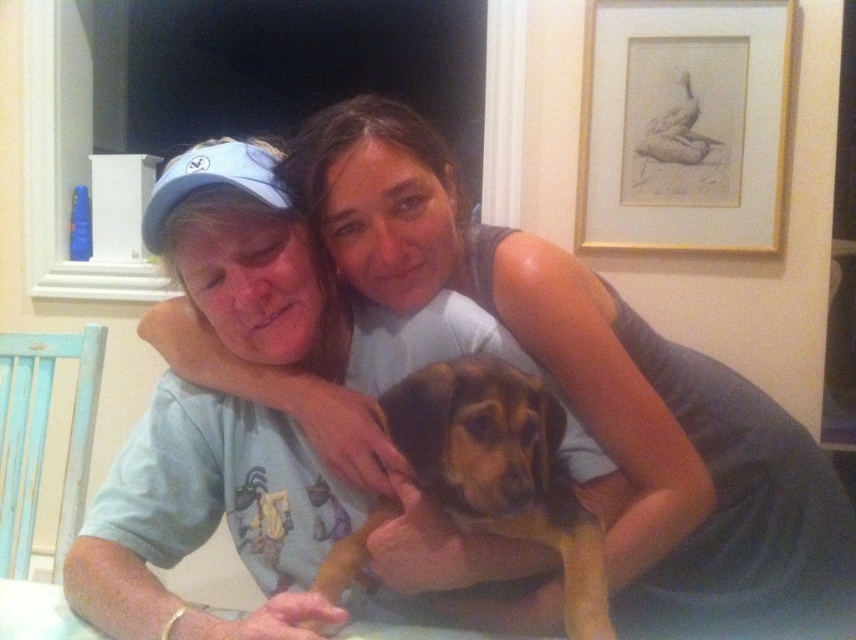
What is the 2D coordinate of the gold framed drawing at upper right in the image?

The 2D coordinate of the gold framed drawing at upper right is at point (682, 124).

You are standing in front of the scene and want to know which of the two points, point (x=655, y=572) or point (x=531, y=403), is closer to you. Can you determine this based on their positions?

Point (x=655, y=572) is further to the camera than point (x=531, y=403), so the closer point to you is point (x=531, y=403).

You are a guest in the house and want to admire the gold framed drawing at upper right and the brown fur dog at center. Which object is located to the right of the other?

The gold framed drawing at upper right is positioned on the right side of brown fur dog at center, so the gold framed drawing at upper right is to the right of the brown fur dog at center.